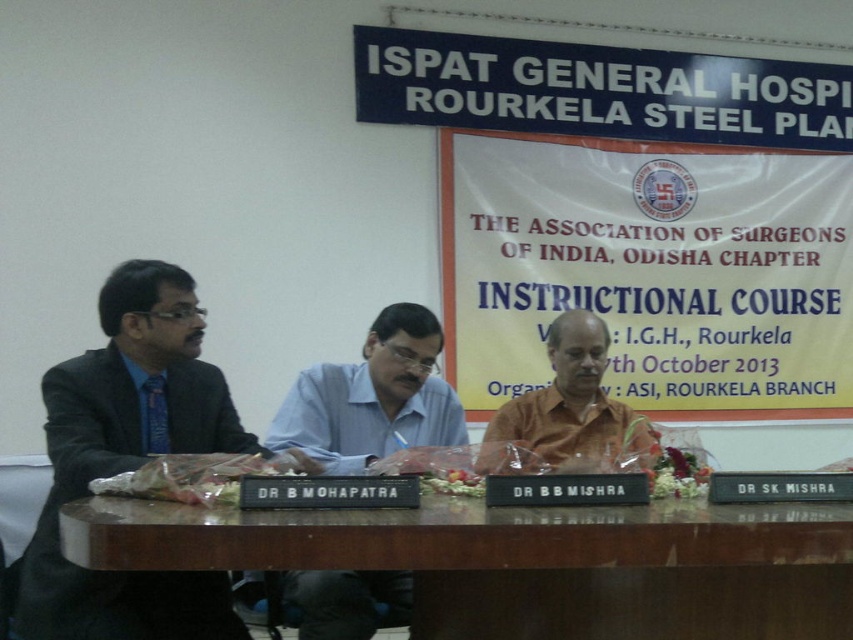
You are a guest speaker at the event and need to place your notes on the brown wooden table at center. Considering the height of the matte black suit at left, will the table be tall enough for you to comfortably access your notes without leaning over excessively?

The brown wooden table at center has a lesser height compared to matte black suit at left, so the table may be too low for comfortable access without leaning forward. Adjust your seating or use a stand to elevate your notes.

In the image of the formal panel discussion, there is a yellow paper at center and a matte black suit at left. From the perspective of someone sitting across the table, which object is positioned higher?

The yellow paper at center is located above the matte black suit at left, so it is positioned higher from the perspective of someone sitting across the table.

You are standing in front of the panel discussion setup. There are two points marked in the image. The first point is at coordinate point (590, 228) and the second point is at coordinate point (155, 323). Which point is closer to you?

Point (590, 228) is further to the viewer than point (155, 323), so the second point is closer to you.